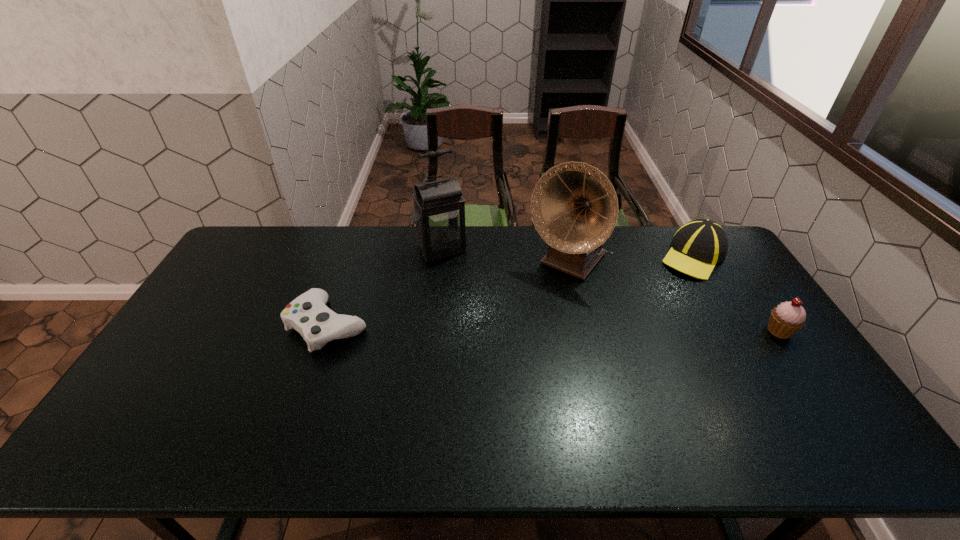
Where is `cupcake positioned at the right edge`? This screenshot has width=960, height=540. cupcake positioned at the right edge is located at coordinates (786, 319).

The width and height of the screenshot is (960, 540). Identify the location of baseball cap present at the right edge. (699, 245).

Image resolution: width=960 pixels, height=540 pixels. What are the coordinates of `object that is at the far right corner` in the screenshot? It's located at (699, 245).

Find the location of a particular element. The width and height of the screenshot is (960, 540). vacant region at the far edge of the desktop is located at coordinates (412, 242).

At what (x,y) coordinates should I click in order to perform the action: click on vacant space at the near edge. Please return your answer as a coordinate pair (x, y). The height and width of the screenshot is (540, 960). Looking at the image, I should click on (668, 409).

Where is `free region at the left edge`? free region at the left edge is located at coordinates 185,321.

Where is `free space at the right edge of the desktop`? free space at the right edge of the desktop is located at coordinates (720, 297).

The width and height of the screenshot is (960, 540). In the image, there is a desktop. What are the coordinates of `free region at the far right corner` in the screenshot? It's located at (670, 227).

The height and width of the screenshot is (540, 960). In the image, there is a desktop. In order to click on vacant space at the near right corner in this screenshot , I will do `click(793, 394)`.

Identify the location of empty space that is in between the baseball cap and the shortest object. Image resolution: width=960 pixels, height=540 pixels. 511,291.